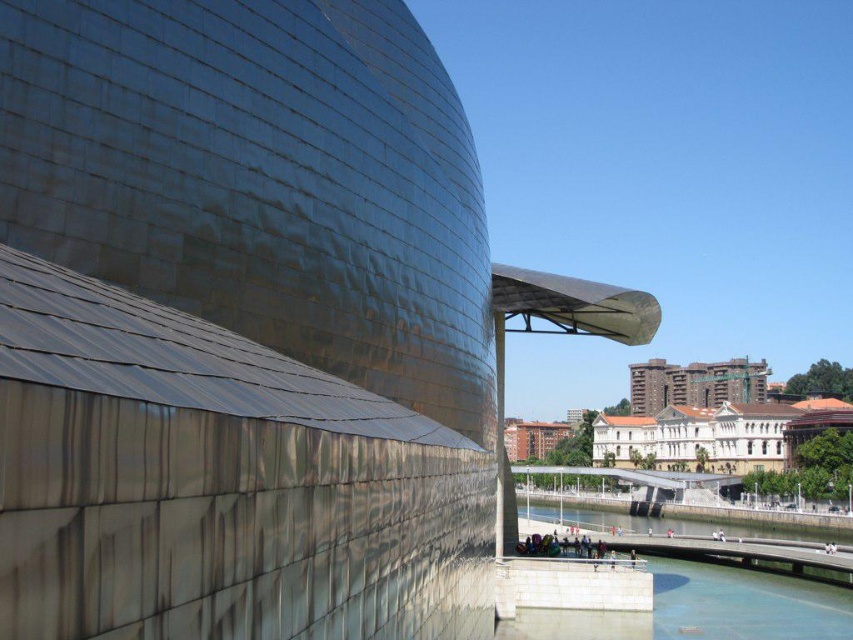
You are an architect evaluating the image. You need to determine which object occupies more space in the image. Based on the scene, which is bigger between the dark brown brick building at center and the clear water at lower center?

The dark brown brick building at center has a larger size compared to the clear water at lower center, so the dark brown brick building at center occupies more space in the image.

You are standing in front of the architectural structure and want to determine which of the two points, point (556,637) or point (674,381), is nearer to you. Based on the scene description, which point is closer?

Point (556,637) is closer to the viewer than point (674,381).

Based on the photo, you are an architect analyzing the image of the building. You notice two instances of water labeled as clear glass water at lower center and clear water at lower center. Which one takes up more area in the image?

The clear water at lower center occupies more space than the clear glass water at lower center, as stated in the description.